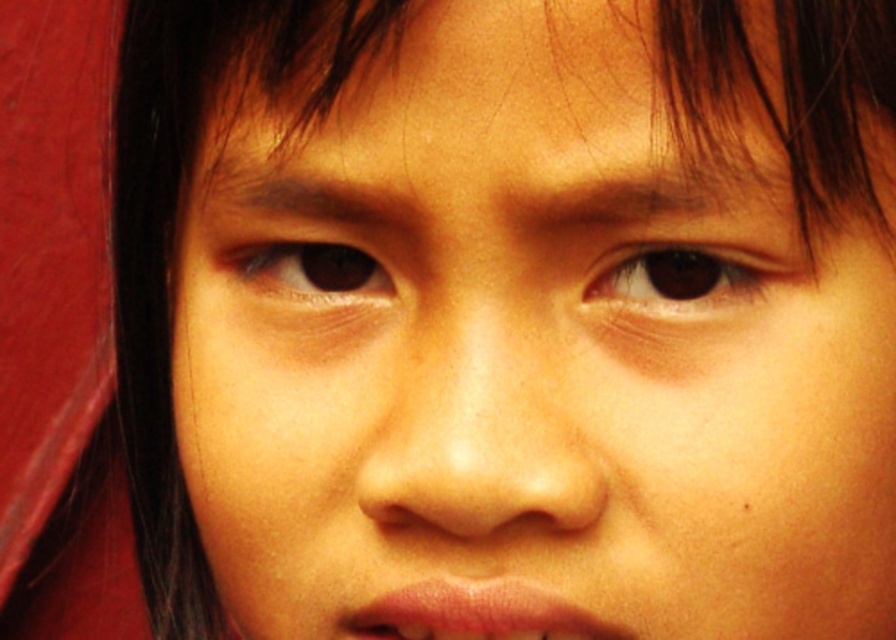
You are a photographer trying to adjust the focus of your camera. The subject has a point at coordinates point (727,269). If your camera can focus on objects within 13 inches, will the point be in focus?

The distance of point (727,269) from the camera is 12.83 inches, which is within the camera focus range of 13 inches. Therefore, the point will be in focus.

You are a photographer adjusting the focus on your camera. You want to ensure both the brown matte eye at upper center and the brown matte eye at center are in focus. Which eye should you focus on first to achieve this?

You should focus on the brown matte eye at upper center first because it is closer to the viewer, allowing the depth of field to naturally cover the brown matte eye at center which is further away.